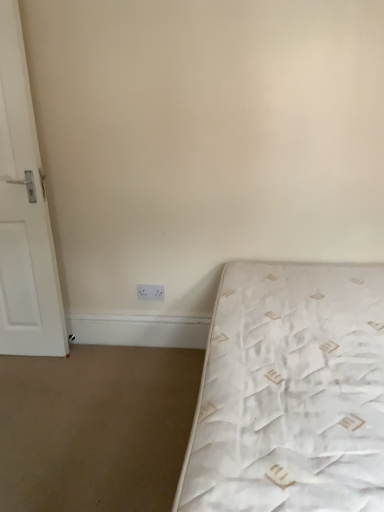
Question: Is white matte door at left bigger or smaller than white quilted mattress at lower right?

Choices:
 (A) small
 (B) big

Answer: (A)

Question: Considering the positions of white matte door at left and white quilted mattress at lower right in the image, is white matte door at left wider or thinner than white quilted mattress at lower right?

Choices:
 (A) wide
 (B) thin

Answer: (B)

Question: Which of these objects is positioned closest to the white plastic electric outlet at lower center?

Choices:
 (A) white quilted mattress at lower right
 (B) white matte door at left

Answer: (B)

Question: Based on their relative distances, which object is farther from the white quilted mattress at lower right?

Choices:
 (A) white plastic electric outlet at lower center
 (B) white matte door at left

Answer: (B)